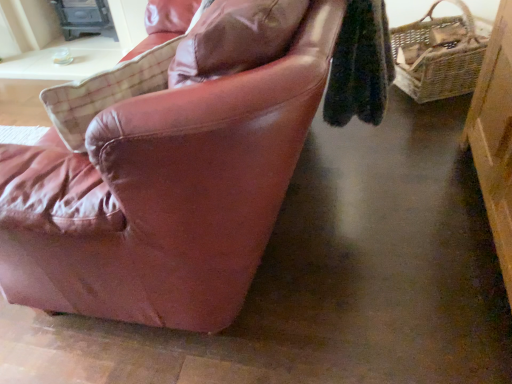
Find the location of `woven brown picnic basket at right`. woven brown picnic basket at right is located at coordinates (438, 55).

Image resolution: width=512 pixels, height=384 pixels. What do you see at coordinates (438, 55) in the screenshot?
I see `woven brown picnic basket at right` at bounding box center [438, 55].

This screenshot has height=384, width=512. I want to click on leather chair at left, so click(x=164, y=194).

This screenshot has width=512, height=384. What do you see at coordinates (164, 194) in the screenshot? I see `leather chair at left` at bounding box center [164, 194].

In order to face leather chair at left, should I rotate leftwards or rightwards?

Turn left approximately 14.578 degrees to face it.

Find the location of a particular element. The width and height of the screenshot is (512, 384). woven brown picnic basket at right is located at coordinates (438, 55).

Considering the relative positions of leather chair at left and woven brown picnic basket at right in the image provided, is leather chair at left to the left or to the right of woven brown picnic basket at right?

In the image, leather chair at left appears on the left side of woven brown picnic basket at right.

Relative to woven brown picnic basket at right, is leather chair at left in front or behind?

leather chair at left is positioned closer to the viewer than woven brown picnic basket at right.

Is point (128, 303) closer to camera compared to point (468, 53)?

Yes, point (128, 303) is in front of point (468, 53).

From the image's perspective, is leather chair at left beneath woven brown picnic basket at right?

Indeed, from the image's perspective, leather chair at left is shown beneath woven brown picnic basket at right.

From a real-world perspective, is leather chair at left physically above woven brown picnic basket at right?

No.

Considering the relative sizes of leather chair at left and woven brown picnic basket at right in the image provided, is leather chair at left wider than woven brown picnic basket at right?

Yes.

Who is taller, leather chair at left or woven brown picnic basket at right?

With more height is woven brown picnic basket at right.

Does leather chair at left have a smaller size compared to woven brown picnic basket at right?

No, leather chair at left is not smaller than woven brown picnic basket at right.

Is leather chair at left inside the boundaries of woven brown picnic basket at right, or outside?

leather chair at left is spatially situated outside woven brown picnic basket at right.

Is leather chair at left positioned far away from woven brown picnic basket at right?

leather chair at left is far away from woven brown picnic basket at right.

Is leather chair at left facing away from woven brown picnic basket at right?

No, leather chair at left's orientation is not away from woven brown picnic basket at right.

How different are the orientations of leather chair at left and woven brown picnic basket at right in degrees?

There is a 55.9-degree angle between the facing directions of leather chair at left and woven brown picnic basket at right.

Image resolution: width=512 pixels, height=384 pixels. What are the coordinates of `picnic basket above the leather chair at left (from a real-world perspective)` in the screenshot? It's located at (438, 55).

Which is more to the right, woven brown picnic basket at right or leather chair at left?

woven brown picnic basket at right.

Is the position of woven brown picnic basket at right more distant than that of leather chair at left?

Yes, it is.

Is point (461, 17) farther from viewer compared to point (111, 142)?

Yes, it is behind point (111, 142).

From the image's perspective, is woven brown picnic basket at right located beneath leather chair at left?

No.

From a real-world perspective, which object stands above the other?

In real-world perspective, woven brown picnic basket at right is above.

Which of these two, woven brown picnic basket at right or leather chair at left, is wider?

Wider between the two is leather chair at left.

Considering the relative sizes of woven brown picnic basket at right and leather chair at left in the image provided, is woven brown picnic basket at right taller than leather chair at left?

Yes.

Consider the image. Considering the relative sizes of woven brown picnic basket at right and leather chair at left in the image provided, is woven brown picnic basket at right smaller than leather chair at left?

Indeed, woven brown picnic basket at right has a smaller size compared to leather chair at left.

Could leather chair at left be considered to be inside woven brown picnic basket at right?

Actually, leather chair at left is outside woven brown picnic basket at right.

Is woven brown picnic basket at right not close to leather chair at left?

Yes, woven brown picnic basket at right and leather chair at left are quite far apart.

Is woven brown picnic basket at right looking in the opposite direction of leather chair at left?

That's not correct — woven brown picnic basket at right is not looking away from leather chair at left.

What's the angular difference between woven brown picnic basket at right and leather chair at left's facing directions?

55.9 degrees separate the facing orientations of woven brown picnic basket at right and leather chair at left.

Measure the distance between woven brown picnic basket at right and leather chair at left.

woven brown picnic basket at right is 5.26 feet away from leather chair at left.

The height and width of the screenshot is (384, 512). Find the location of `picnic basket that is above the leather chair at left (from a real-world perspective)`. picnic basket that is above the leather chair at left (from a real-world perspective) is located at coordinates (438, 55).

Identify the location of chair below the woven brown picnic basket at right (from the image's perspective). The height and width of the screenshot is (384, 512). (164, 194).

Image resolution: width=512 pixels, height=384 pixels. Find the location of `picnic basket on the right of leather chair at left`. picnic basket on the right of leather chair at left is located at coordinates (438, 55).